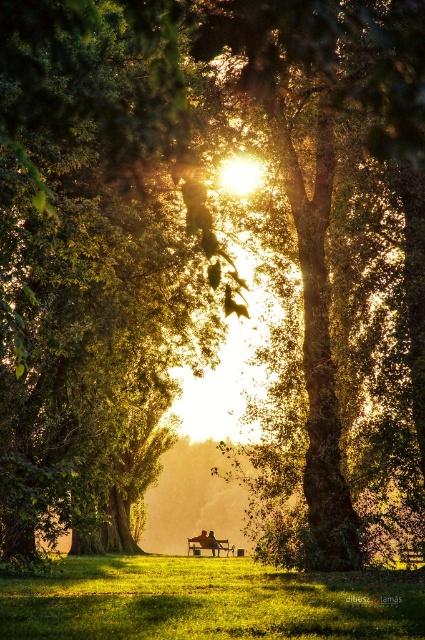
Who is positioned more to the left, wooden bench at center or red fabric person at center?

wooden bench at center is more to the left.

Who is lower down, wooden bench at center or red fabric person at center?

red fabric person at center is lower down.

The width and height of the screenshot is (425, 640). What do you see at coordinates (209, 545) in the screenshot? I see `wooden bench at center` at bounding box center [209, 545].

The width and height of the screenshot is (425, 640). I want to click on wooden bench at center, so click(x=209, y=545).